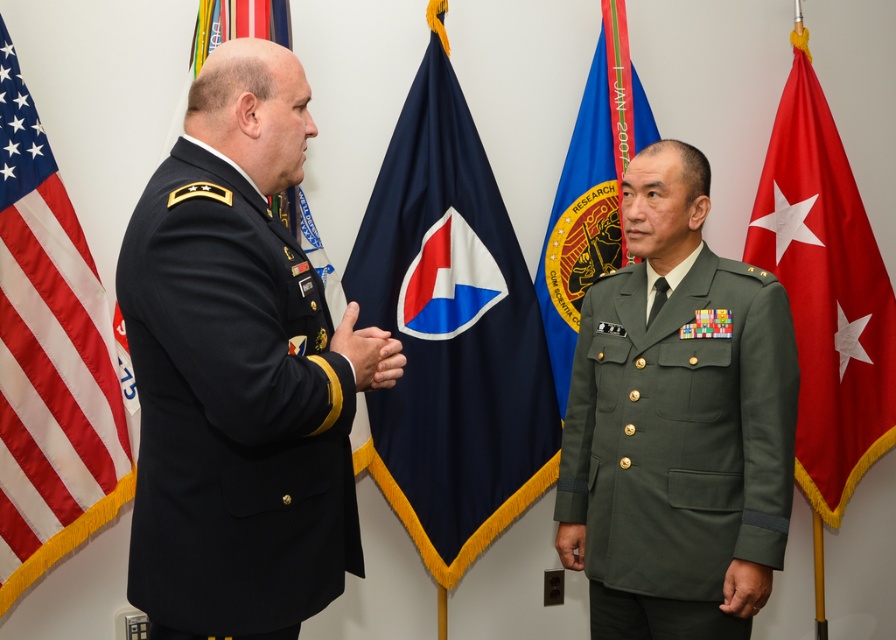
You are a photographer adjusting your camera settings to capture the scene of two military officers in a formal meeting. You notice the blue fabric flag at center and the matte black hand at center in your viewfinder. Which object appears taller in the frame?

The blue fabric flag at center appears taller than the matte black hand at center in the frame.

You are an observer in the room where two blue fabric flags are present. Which flag is closer to you, the blue fabric flag at center or the blue fabric flag at upper left?

The blue fabric flag at center is closer to you because it is further to the viewer than the blue fabric flag at upper left.

You are an observer in the room where the green fabric uniform at center and the blue fabric flag at upper left are present. Which object is located to the right of the other?

The green fabric uniform at center is positioned on the right side of blue fabric flag at upper left.